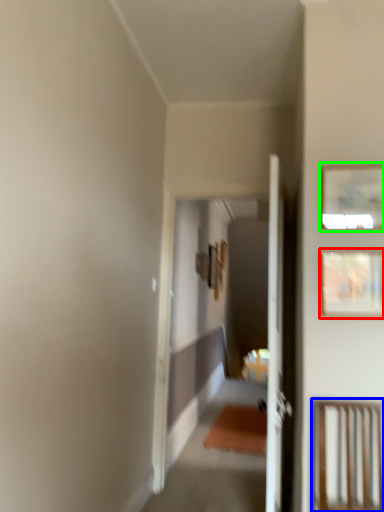
Question: Considering the real-world distances, which object is farthest from picture frame (highlighted by a red box)? furniture (highlighted by a blue box) or picture frame (highlighted by a green box)?

Choices:
 (A) furniture
 (B) picture frame

Answer: (A)